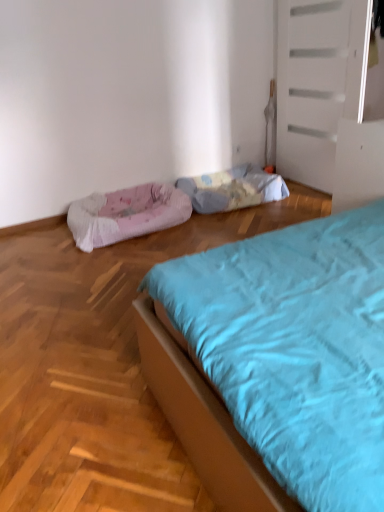
Question: Looking at their shapes, would you say fluffy blue blanket at center is wider or thinner than pink textured dog bed at left?

Choices:
 (A) thin
 (B) wide

Answer: (A)

Question: Based on their positions, is fluffy blue blanket at center located to the left or right of pink textured dog bed at left?

Choices:
 (A) right
 (B) left

Answer: (A)

Question: Considering the positions of fluffy blue blanket at center and pink textured dog bed at left in the image, is fluffy blue blanket at center taller or shorter than pink textured dog bed at left?

Choices:
 (A) tall
 (B) short

Answer: (A)

Question: In terms of width, does pink textured dog bed at left look wider or thinner when compared to fluffy blue blanket at center?

Choices:
 (A) wide
 (B) thin

Answer: (A)

Question: Based on their sizes in the image, would you say pink textured dog bed at left is bigger or smaller than fluffy blue blanket at center?

Choices:
 (A) small
 (B) big

Answer: (B)

Question: From their relative heights in the image, would you say pink textured dog bed at left is taller or shorter than fluffy blue blanket at center?

Choices:
 (A) tall
 (B) short

Answer: (B)

Question: From the image's perspective, is pink textured dog bed at left above or below fluffy blue blanket at center?

Choices:
 (A) above
 (B) below

Answer: (B)